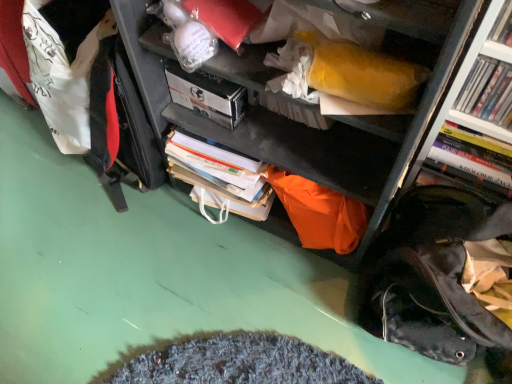
Question: Considering the positions of hardcover book at upper right, the third book when ordered from back to front, and white glossy book at upper right, which appears as the 2th book when viewed from the back, in the image, is hardcover book at upper right, the third book when ordered from back to front, bigger or smaller than white glossy book at upper right, which appears as the 2th book when viewed from the back,?

Choices:
 (A) big
 (B) small

Answer: (B)

Question: Based on their positions, is hardcover book at upper right, positioned as the first book in front-to-back order, located to the left or right of white glossy book at upper right, which appears as the 2th book when viewed from the back?

Choices:
 (A) right
 (B) left

Answer: (B)

Question: Estimate the real-world distances between objects in this image. Which object is closer to the white matte paperback book at upper center?

Choices:
 (A) white glossy book at upper right, which appears as the 2th book when viewed from the back
 (B) hardcover book at right, acting as the 1th book starting from the back
 (C) hardcover book at upper right, the third book when ordered from back to front

Answer: (A)

Question: Which object is positioned farthest from the white matte paperback book at upper center?

Choices:
 (A) white glossy book at upper right, placed as the 2th book when sorted from front to back
 (B) hardcover book at upper right, the third book when ordered from back to front
 (C) hardcover book at right, acting as the 1th book starting from the back

Answer: (B)